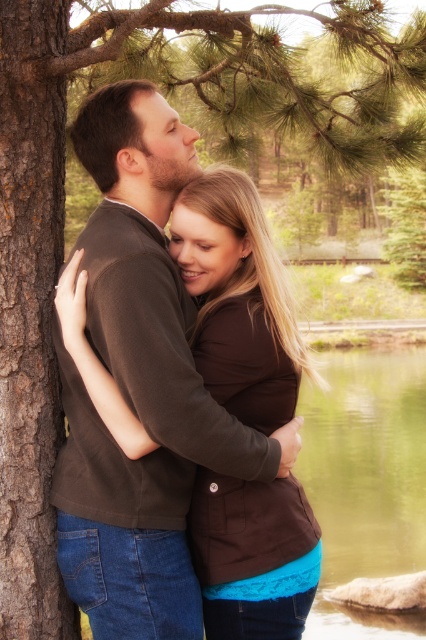
Question: Which object appears closest to the camera in this image?

Choices:
 (A) brown matte sweater at center
 (B) green liquid water at lower center

Answer: (A)

Question: Which point appears farthest from the camera in this image?

Choices:
 (A) (103, 260)
 (B) (385, 458)

Answer: (B)

Question: Can you confirm if brown matte sweater at center is positioned to the left of green liquid water at lower center?

Choices:
 (A) no
 (B) yes

Answer: (B)

Question: Can you confirm if brown matte sweater at center is positioned above green liquid water at lower center?

Choices:
 (A) no
 (B) yes

Answer: (B)

Question: Which object is farther from the camera taking this photo?

Choices:
 (A) brown matte sweater at center
 (B) green liquid water at lower center

Answer: (B)

Question: Can you confirm if brown matte sweater at center is positioned to the left of green liquid water at lower center?

Choices:
 (A) no
 (B) yes

Answer: (B)